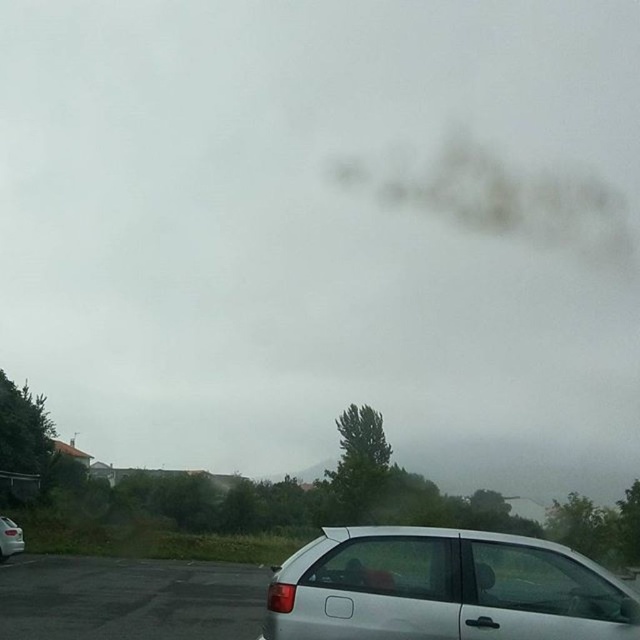
Question: Is silver metallic hatchback at lower center further to camera compared to silver metallic car at lower left?

Choices:
 (A) no
 (B) yes

Answer: (A)

Question: Is black asphalt parking lot at lower left thinner than silver metallic car at lower left?

Choices:
 (A) no
 (B) yes

Answer: (A)

Question: Which of the following is the farthest from the observer?

Choices:
 (A) (188, 586)
 (B) (20, 529)
 (C) (490, 580)

Answer: (B)

Question: Among these objects, which one is nearest to the camera?

Choices:
 (A) black asphalt parking lot at lower left
 (B) silver metallic hatchback at lower center

Answer: (B)

Question: Which object is farther from the camera taking this photo?

Choices:
 (A) silver metallic car at lower left
 (B) black asphalt parking lot at lower left
 (C) silver metallic hatchback at lower center

Answer: (A)

Question: From the image, what is the correct spatial relationship of silver metallic hatchback at lower center in relation to black asphalt parking lot at lower left?

Choices:
 (A) above
 (B) below

Answer: (A)